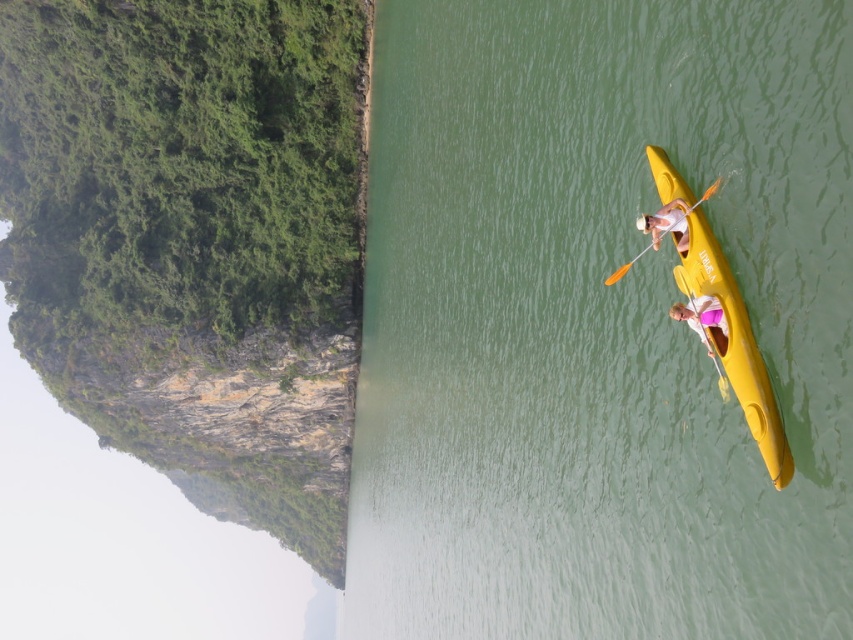
Question: Estimate the real-world distances between objects in this image. Which object is closer to the yellow plastic paddle at right?

Choices:
 (A) white matte kayak at upper right
 (B) pink fabric at right

Answer: (A)

Question: Among these points, which one is farthest from the camera?

Choices:
 (A) (778, 438)
 (B) (714, 364)

Answer: (B)

Question: Can you confirm if green rubber kayak at right is positioned to the right of white matte kayak at upper right?

Choices:
 (A) no
 (B) yes

Answer: (A)

Question: Does pink fabric at right come behind yellow plastic paddle at right?

Choices:
 (A) no
 (B) yes

Answer: (A)

Question: Where is pink fabric at right located in relation to yellow plastic paddle at right in the image?

Choices:
 (A) below
 (B) above

Answer: (A)

Question: Among these points, which one is farthest from the camera?

Choices:
 (A) [670, 189]
 (B) [579, 93]

Answer: (B)